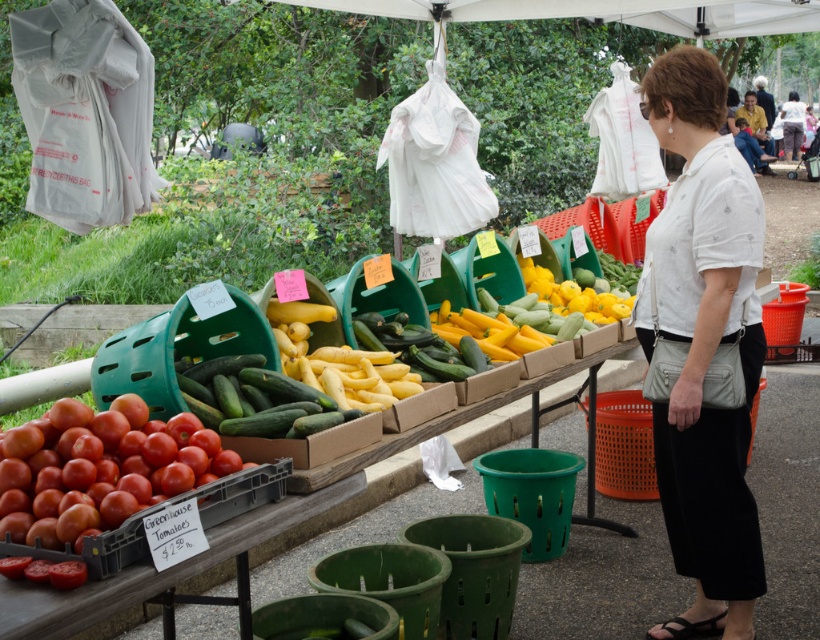
Question: Can you confirm if shiny red tomatoes at lower left is wider than matte white blouse at center?

Choices:
 (A) no
 (B) yes

Answer: (A)

Question: Can you confirm if white printed blouse at center is positioned below shiny red tomatoes at lower left?

Choices:
 (A) no
 (B) yes

Answer: (A)

Question: Does green matte cucumber at center have a lesser width compared to matte white blouse at center?

Choices:
 (A) yes
 (B) no

Answer: (A)

Question: Which object is the closest to the green matte cucumber at center?

Choices:
 (A) matte white blouse at center
 (B) yellow matte zucchini at center
 (C) white printed blouse at center
 (D) shiny red tomatoes at lower left

Answer: (D)

Question: Which object appears closest to the camera in this image?

Choices:
 (A) white printed blouse at center
 (B) green matte cucumber at center

Answer: (B)

Question: Estimate the real-world distances between objects in this image. Which object is closer to the yellow matte zucchini at center?

Choices:
 (A) matte white blouse at center
 (B) white printed blouse at center
 (C) green matte cucumber at center

Answer: (B)